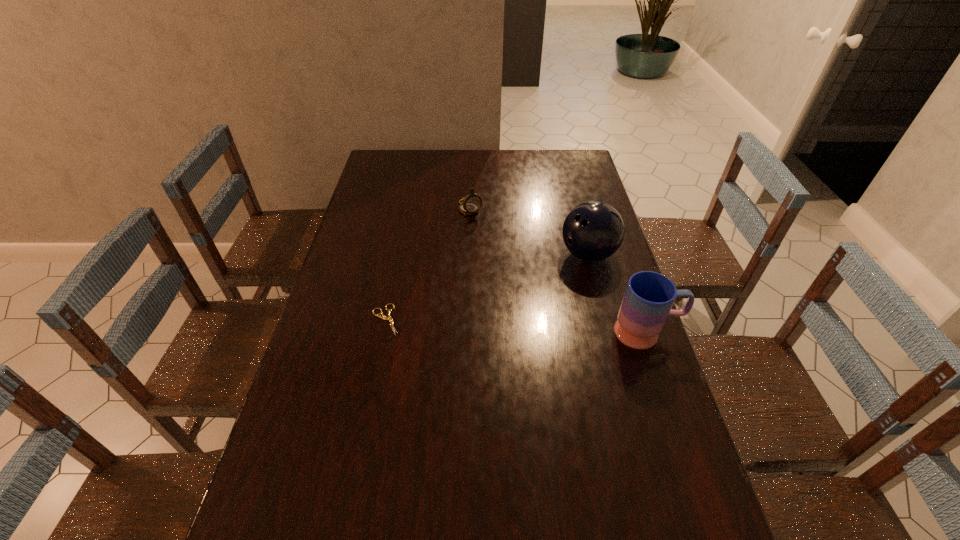
The height and width of the screenshot is (540, 960). I want to click on free space on the desktop that is between the leftmost object and the mug and is positioned on the surface of the bowling ball near the finger holes, so click(x=516, y=326).

Locate an element on the screen. The image size is (960, 540). free space on the desktop that is between the shortest object and the mug and is positioned on the face of the second object from left to right is located at coordinates (550, 328).